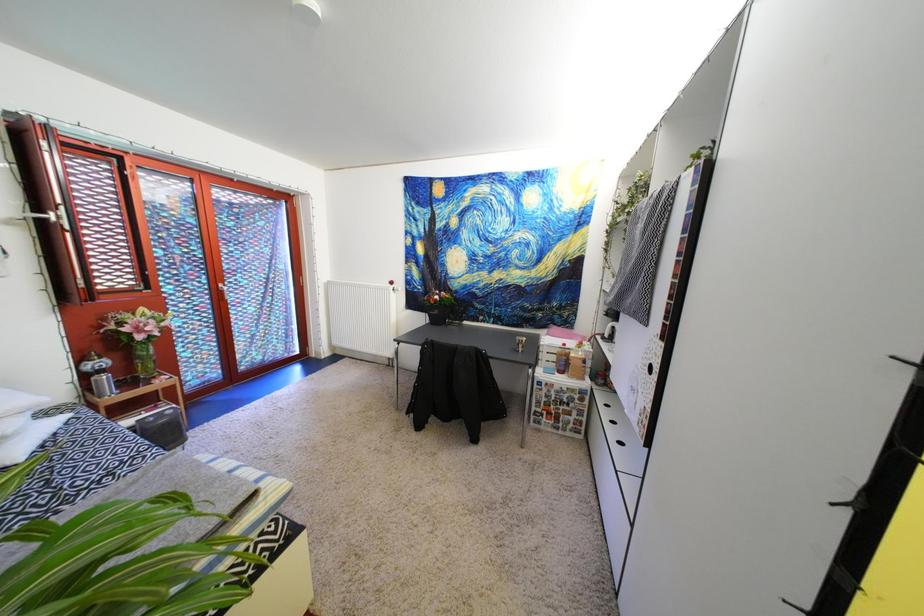
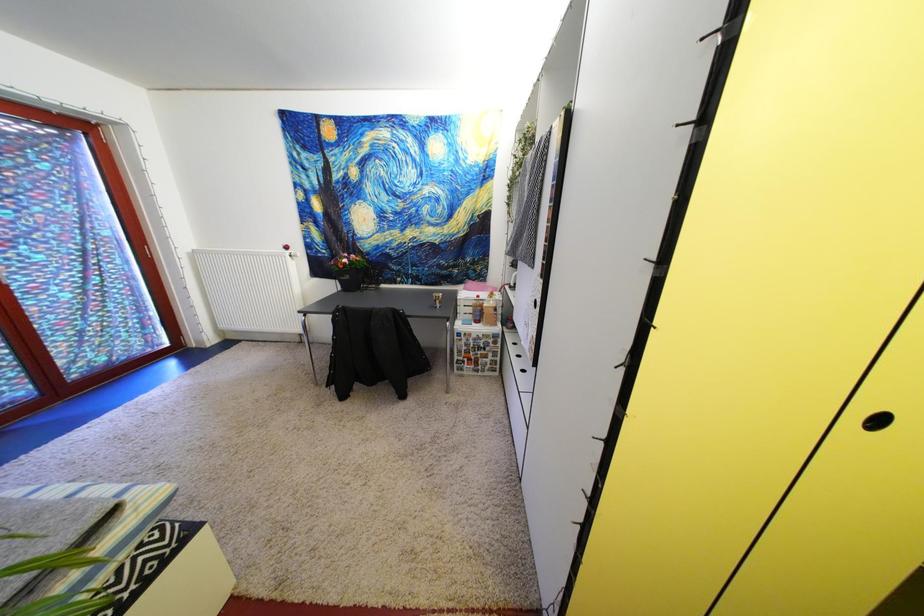
Question: Which direction would the cameraman need to move to produce the second image? Reply with the corresponding letter.

Choices:
 (A) Left
 (B) Right
 (C) Forward
 (D) Backward

Answer: (B)